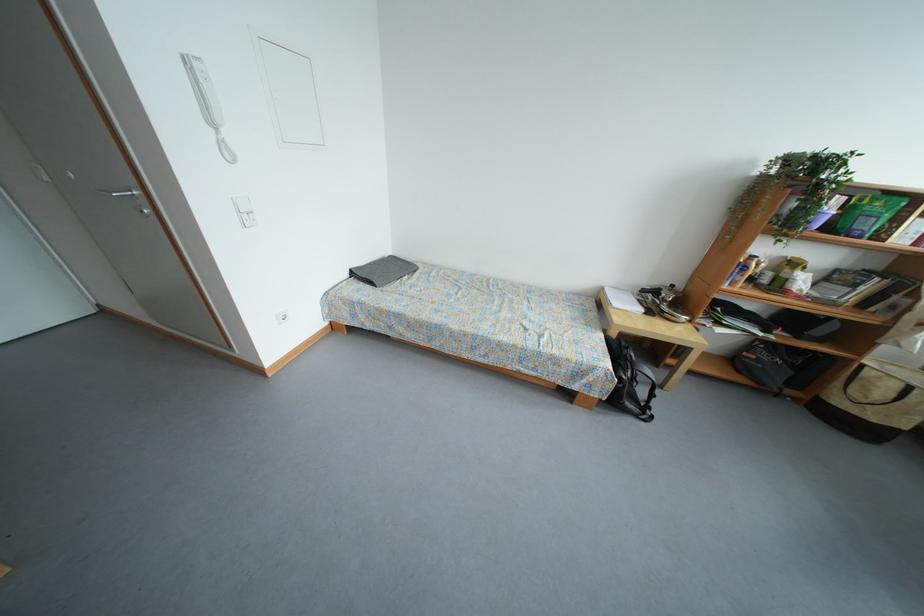
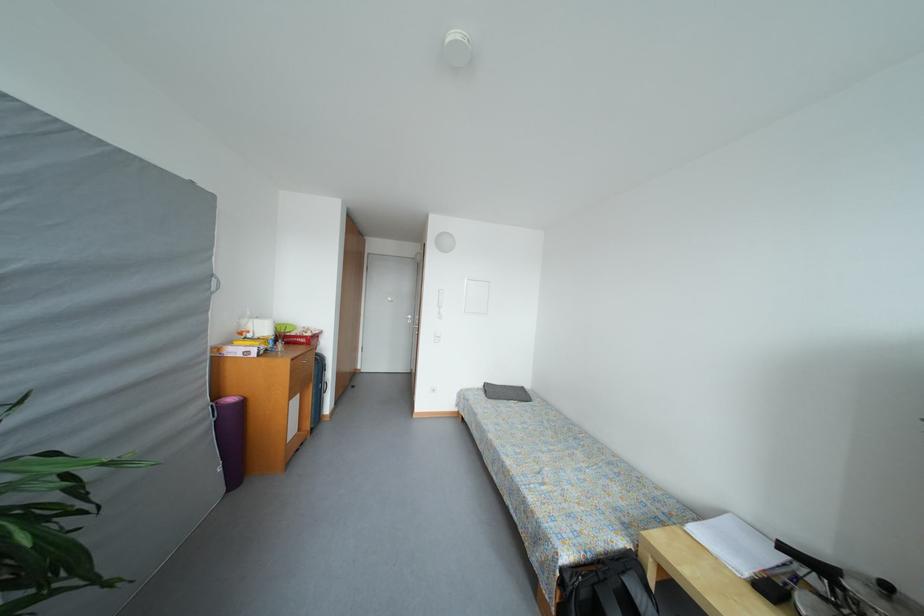
Where in the second image is the point corresponding to (460,331) from the first image?

(496, 440)